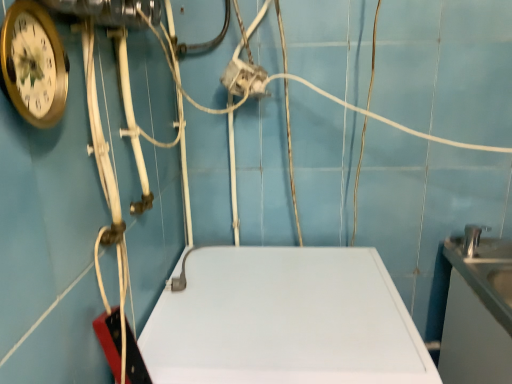
Question: Is satin silver sink at right shorter than white glossy counter top at right, which appears as the second counter top when viewed from the left?

Choices:
 (A) yes
 (B) no

Answer: (A)

Question: From the image's perspective, is satin silver sink at right located beneath white glossy counter top at right, the 1th counter top viewed from the right?

Choices:
 (A) no
 (B) yes

Answer: (A)

Question: Would you say satin silver sink at right is outside white glossy counter top at right, the 1th counter top viewed from the right?

Choices:
 (A) yes
 (B) no

Answer: (A)

Question: Considering the relative sizes of satin silver sink at right and white glossy counter top at right, which appears as the second counter top when viewed from the left, in the image provided, is satin silver sink at right bigger than white glossy counter top at right, which appears as the second counter top when viewed from the left,?

Choices:
 (A) no
 (B) yes

Answer: (A)

Question: Is white glossy counter top at right, the 1th counter top viewed from the right, at the back of satin silver sink at right?

Choices:
 (A) no
 (B) yes

Answer: (A)

Question: Can you confirm if satin silver sink at right is taller than white glossy counter top at right, which appears as the second counter top when viewed from the left?

Choices:
 (A) no
 (B) yes

Answer: (A)

Question: Considering the relative positions of white glossy counter top at right, the 1th counter top viewed from the right, and satin silver sink at right in the image provided, is white glossy counter top at right, the 1th counter top viewed from the right, to the right of satin silver sink at right from the viewer's perspective?

Choices:
 (A) no
 (B) yes

Answer: (A)

Question: Would you consider white glossy counter top at right, the 1th counter top viewed from the right, to be distant from satin silver sink at right?

Choices:
 (A) no
 (B) yes

Answer: (A)

Question: From the image's perspective, would you say white glossy counter top at right, the 1th counter top viewed from the right, is shown under satin silver sink at right?

Choices:
 (A) yes
 (B) no

Answer: (A)

Question: Could you tell me if white glossy counter top at right, the 1th counter top viewed from the right, is facing satin silver sink at right?

Choices:
 (A) no
 (B) yes

Answer: (A)

Question: Considering the relative sizes of white glossy counter top at right, which appears as the second counter top when viewed from the left, and satin silver sink at right in the image provided, is white glossy counter top at right, which appears as the second counter top when viewed from the left, shorter than satin silver sink at right?

Choices:
 (A) yes
 (B) no

Answer: (B)

Question: From the image's perspective, is white glossy counter top at right, the 1th counter top viewed from the right, located above satin silver sink at right?

Choices:
 (A) yes
 (B) no

Answer: (B)

Question: From the image's perspective, is white matte counter top at center, the second counter top positioned from the right, over satin silver sink at right?

Choices:
 (A) no
 (B) yes

Answer: (A)